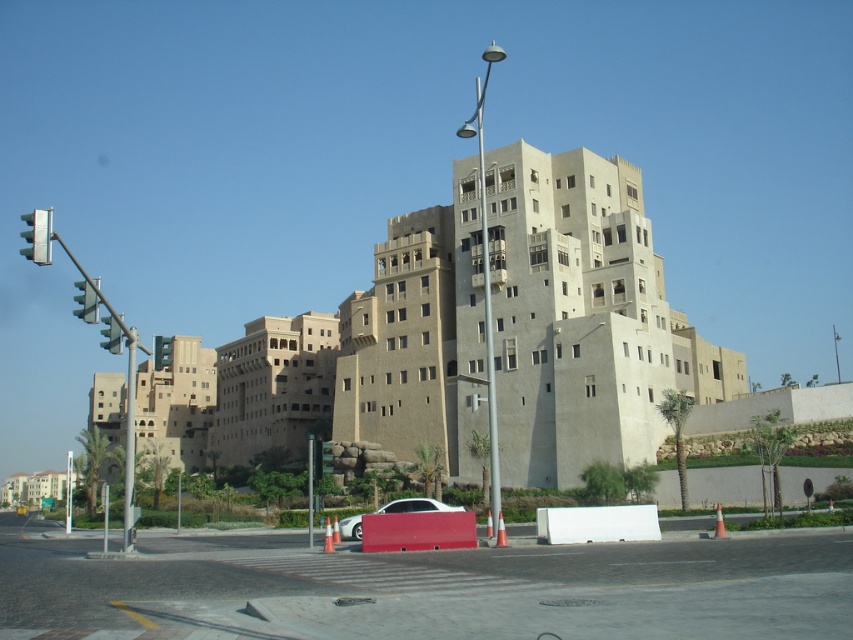
Does point (94, 296) come farther from viewer compared to point (111, 337)?

No, (94, 296) is closer to viewer.

Locate an element on the screen. green metallic traffic light at left is located at coordinates (86, 301).

Does metallic traffic light at left have a lesser height compared to green glass traffic light at upper left?

No.

Describe the element at coordinates (38, 236) in the screenshot. I see `metallic traffic light at left` at that location.

Where is `metallic traffic light at left`? metallic traffic light at left is located at coordinates coord(38,236).

Who is positioned more to the left, green glass traffic light at left or green glass traffic light at upper left?

green glass traffic light at left

Does green glass traffic light at left have a lesser width compared to green glass traffic light at upper left?

No, green glass traffic light at left is not thinner than green glass traffic light at upper left.

In order to click on green glass traffic light at left in this screenshot , I will do `click(111, 336)`.